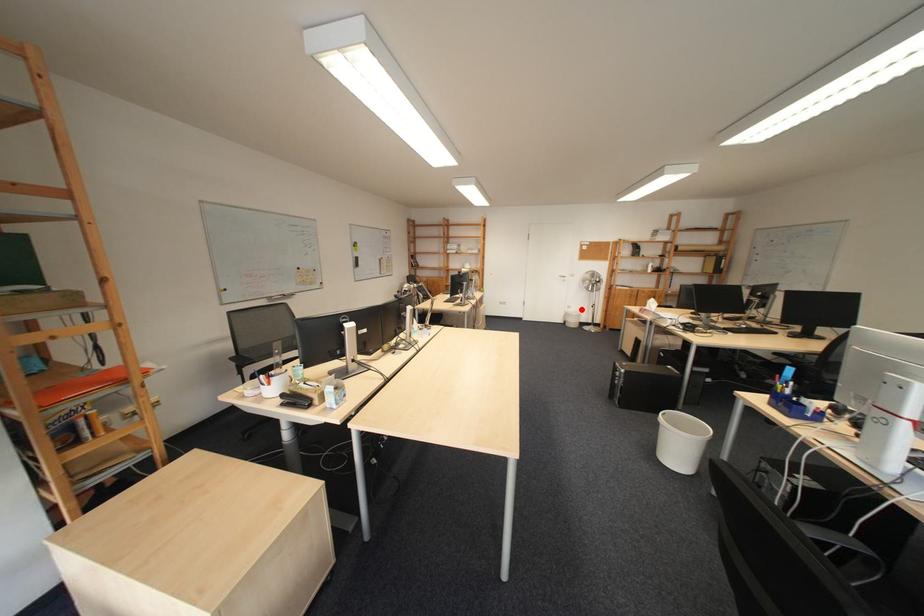
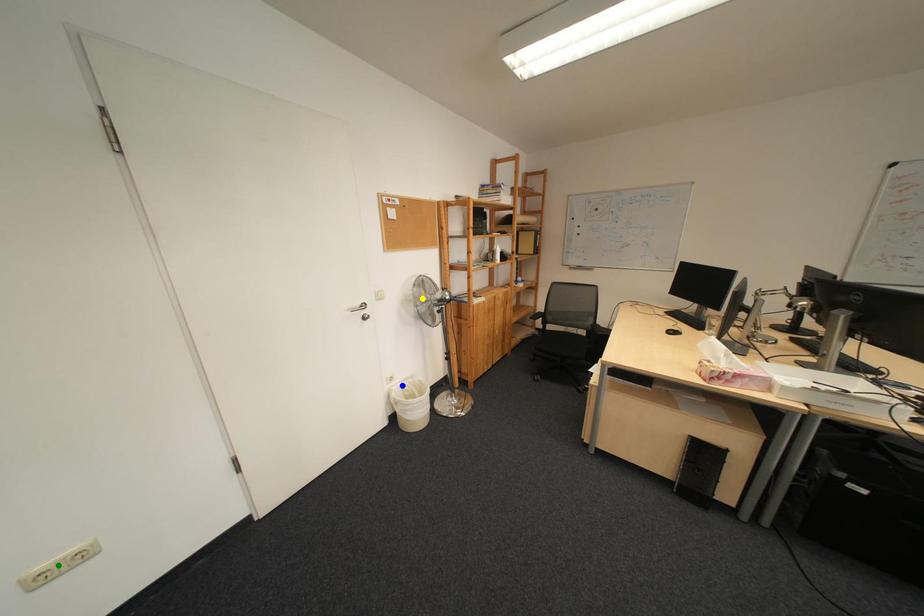
Question: I am providing you with two images of the same scene from different viewpoints. A red point is marked on the first image. You are given multiple points on the second image. In image 2, which mark is for the same physical point as the one in image 1?

Choices:
 (A) green point
 (B) yellow point
 (C) blue point

Answer: (C)